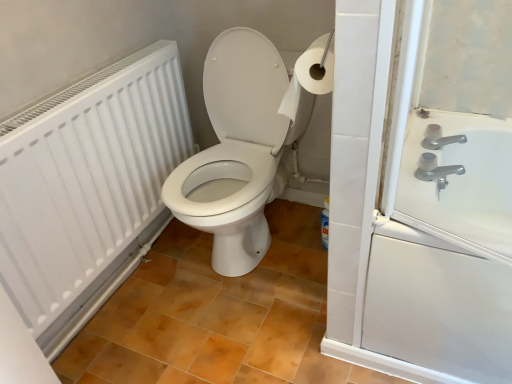
Question: Considering the relative sizes of white matte radiator at left and white glossy toilet at center in the image provided, is white matte radiator at left bigger than white glossy toilet at center?

Choices:
 (A) yes
 (B) no

Answer: (B)

Question: Can you confirm if white matte radiator at left is positioned to the left of white glossy toilet at center?

Choices:
 (A) no
 (B) yes

Answer: (B)

Question: From a real-world perspective, is white matte radiator at left physically above white glossy toilet at center?

Choices:
 (A) yes
 (B) no

Answer: (A)

Question: Is white matte radiator at left taller than white glossy toilet at center?

Choices:
 (A) no
 (B) yes

Answer: (A)

Question: Is white matte radiator at left next to white glossy toilet at center and touching it?

Choices:
 (A) yes
 (B) no

Answer: (B)

Question: Based on their sizes in the image, would you say white glossy toilet at center is bigger or smaller than white paper at upper right?

Choices:
 (A) big
 (B) small

Answer: (A)

Question: Considering the positions of white glossy toilet at center and white paper at upper right in the image, is white glossy toilet at center wider or thinner than white paper at upper right?

Choices:
 (A) thin
 (B) wide

Answer: (B)

Question: Considering the positions of white glossy toilet at center and white paper at upper right in the image, is white glossy toilet at center taller or shorter than white paper at upper right?

Choices:
 (A) tall
 (B) short

Answer: (A)

Question: Considering the relative positions of white glossy toilet at center and white paper at upper right in the image provided, is white glossy toilet at center to the left or to the right of white paper at upper right?

Choices:
 (A) right
 (B) left

Answer: (B)

Question: From a real-world perspective, is white paper at upper right positioned above or below satin nickel faucet at upper right?

Choices:
 (A) above
 (B) below

Answer: (A)

Question: Looking at their shapes, would you say white paper at upper right is wider or thinner than satin nickel faucet at upper right?

Choices:
 (A) wide
 (B) thin

Answer: (A)

Question: From the image's perspective, is white paper at upper right located above or below satin nickel faucet at upper right?

Choices:
 (A) above
 (B) below

Answer: (A)

Question: Considering the positions of white paper at upper right and satin nickel faucet at upper right in the image, is white paper at upper right taller or shorter than satin nickel faucet at upper right?

Choices:
 (A) short
 (B) tall

Answer: (B)

Question: Would you say white glossy toilet at center is inside or outside white matte radiator at left?

Choices:
 (A) outside
 (B) inside

Answer: (A)

Question: Based on their sizes in the image, would you say white glossy toilet at center is bigger or smaller than white matte radiator at left?

Choices:
 (A) big
 (B) small

Answer: (A)